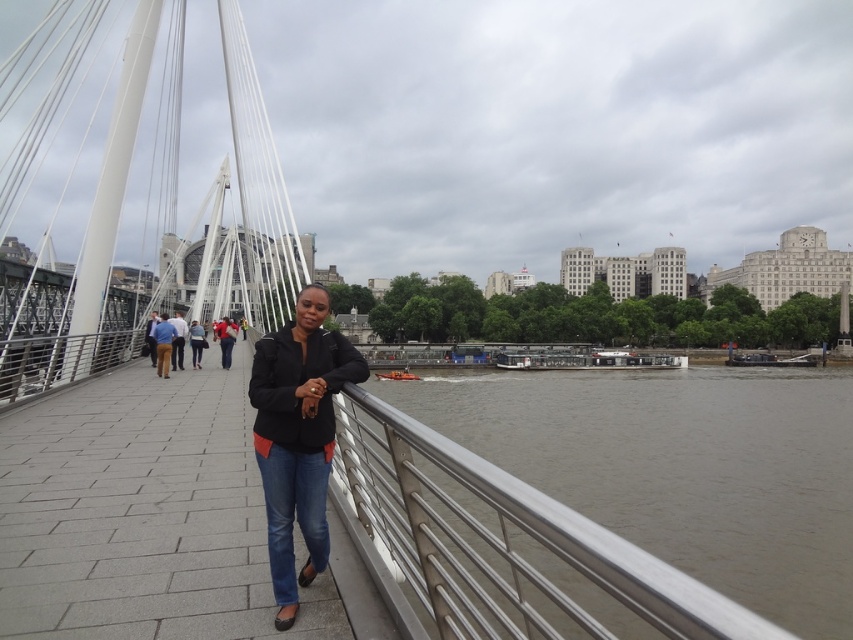
You are standing at the origin point of the coordinate system, which is the bottom left corner of the image. The bridge spans from the origin to the top right corner. A person in a matte black jacket at center is located at coordinate point 0.683, 0.351. If you want to walk directly towards the person, which direction should you move relative to the bridge?

To move directly towards the matte black jacket at center located at coordinate point (x=299, y=436) from the origin, you should move diagonally towards the upper right direction along the bridge since the coordinates increase towards the top right corner.

You are a photographer standing on the bridge. You want to take a photo of the black matte jacket at center and the blue jeans at center. Which one should you focus on first if you want to capture both clearly in the same frame?

The blue jeans at center is behind the black matte jacket at center, so you should focus on the black matte jacket at center first to ensure both are in focus.

You are standing on the bridge and want to walk from point (537,612) to point (144,328). Which direction should you face to move towards the point that is farther away from you?

You should face the direction towards point (144,328) because it is farther away from you than point (537,612).